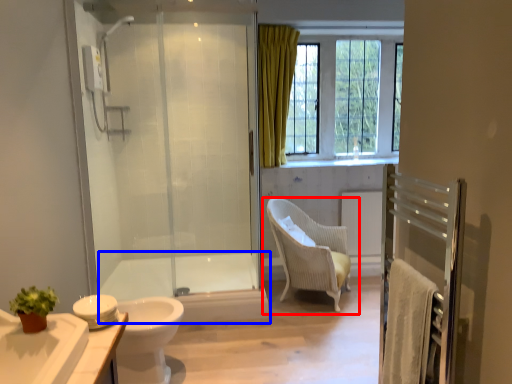
Question: Which of the following is the closest to the observer, chair (highlighted by a red box) or bath (highlighted by a blue box)?

Choices:
 (A) chair
 (B) bath

Answer: (A)